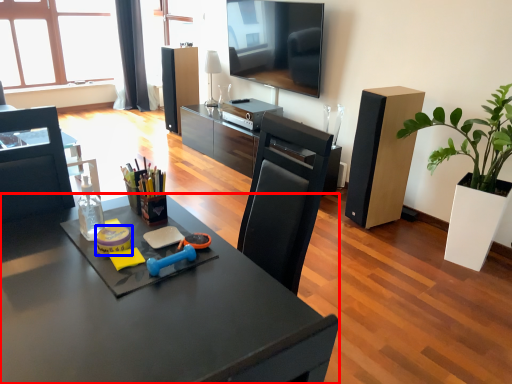
Question: Which point is further to the camera, desk (highlighted by a red box) or stationery (highlighted by a blue box)?

Choices:
 (A) desk
 (B) stationery

Answer: (B)